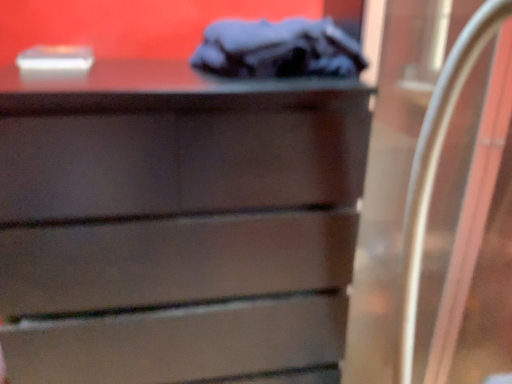
Question: From a real-world perspective, is clear glass door at right positioned under dark gray fabric at upper center based on gravity?

Choices:
 (A) yes
 (B) no

Answer: (A)

Question: Does clear glass door at right appear on the left side of dark gray fabric at upper center?

Choices:
 (A) yes
 (B) no

Answer: (B)

Question: Is clear glass door at right outside dark gray fabric at upper center?

Choices:
 (A) no
 (B) yes

Answer: (B)

Question: Is clear glass door at right wider than dark gray fabric at upper center?

Choices:
 (A) yes
 (B) no

Answer: (A)

Question: Considering the relative sizes of clear glass door at right and dark gray fabric at upper center in the image provided, is clear glass door at right taller than dark gray fabric at upper center?

Choices:
 (A) yes
 (B) no

Answer: (A)

Question: From the image's perspective, would you say clear glass door at right is shown under dark gray fabric at upper center?

Choices:
 (A) no
 (B) yes

Answer: (B)

Question: Considering the relative positions of dark gray fabric at upper center and matte brown chest of drawers at center in the image provided, is dark gray fabric at upper center to the right of matte brown chest of drawers at center from the viewer's perspective?

Choices:
 (A) no
 (B) yes

Answer: (B)

Question: Is the depth of dark gray fabric at upper center less than that of matte brown chest of drawers at center?

Choices:
 (A) no
 (B) yes

Answer: (A)

Question: Is dark gray fabric at upper center aimed at matte brown chest of drawers at center?

Choices:
 (A) no
 (B) yes

Answer: (A)

Question: From a real-world perspective, is dark gray fabric at upper center positioned under matte brown chest of drawers at center based on gravity?

Choices:
 (A) yes
 (B) no

Answer: (B)

Question: From the image's perspective, would you say dark gray fabric at upper center is shown under matte brown chest of drawers at center?

Choices:
 (A) no
 (B) yes

Answer: (A)

Question: Is dark gray fabric at upper center turned away from matte brown chest of drawers at center?

Choices:
 (A) no
 (B) yes

Answer: (A)

Question: Is matte brown chest of drawers at center next to clear glass door at right and touching it?

Choices:
 (A) no
 (B) yes

Answer: (A)